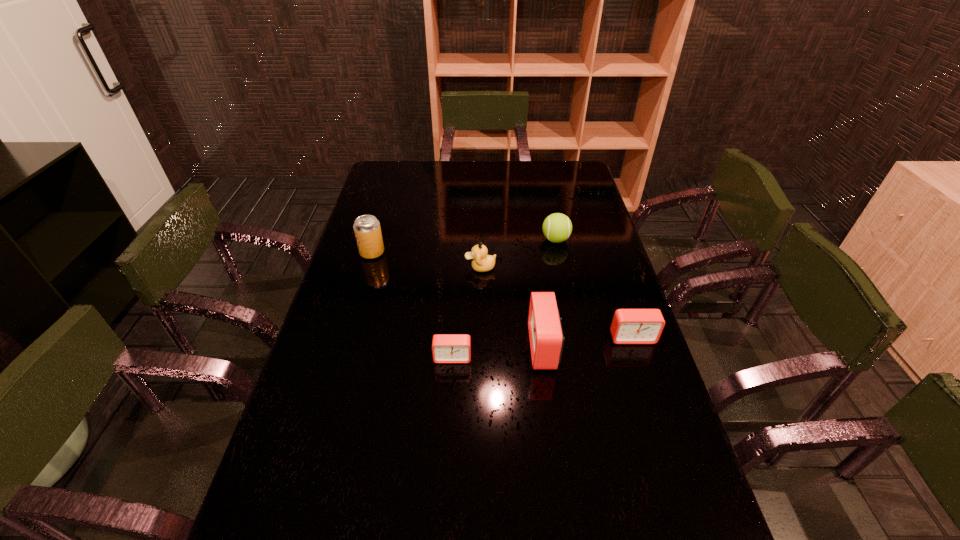
Where is `vacant space situated 0.110m on the front-facing side of the third object from right to left`? This screenshot has height=540, width=960. vacant space situated 0.110m on the front-facing side of the third object from right to left is located at coordinates (490, 347).

Find the location of a particular element. The width and height of the screenshot is (960, 540). vacant region located 0.320m on the front-facing side of the third object from right to left is located at coordinates (414, 347).

The height and width of the screenshot is (540, 960). I want to click on vacant space situated on the front-facing side of the third object from right to left, so click(x=500, y=347).

The height and width of the screenshot is (540, 960). I want to click on blank space located on the front-facing side of the second shortest alarm clock, so click(x=659, y=417).

Identify the location of free spot located 0.060m on the left of the tennis ball. (524, 240).

Where is `free point located 0.160m on the face of the duckling`? Image resolution: width=960 pixels, height=540 pixels. free point located 0.160m on the face of the duckling is located at coordinates (418, 267).

This screenshot has height=540, width=960. Identify the location of vacant space located on the face of the duckling. (378, 267).

Locate an element on the screen. blank space located on the face of the duckling is located at coordinates (408, 267).

Find the location of a particular element. This screenshot has height=540, width=960. free location located 0.260m on the front of the leftmost object is located at coordinates (353, 317).

Identify the location of object that is at the left edge. (367, 230).